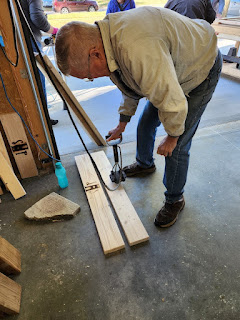
Find the location of a particular element. Image resolution: width=240 pixels, height=320 pixels. floor is located at coordinates (210, 244).